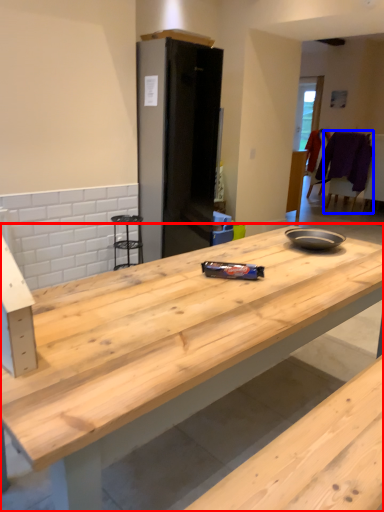
Question: Which object is further to the camera taking this photo, countertop (highlighted by a red box) or chair (highlighted by a blue box)?

Choices:
 (A) countertop
 (B) chair

Answer: (B)